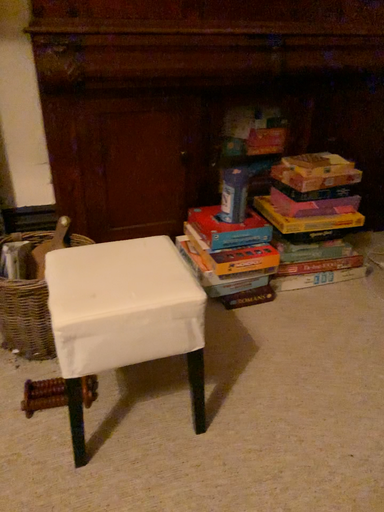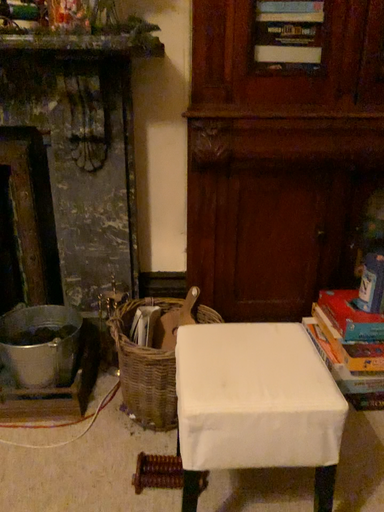
Question: How did the camera likely rotate when shooting the video?

Choices:
 (A) rotated left
 (B) rotated right

Answer: (A)